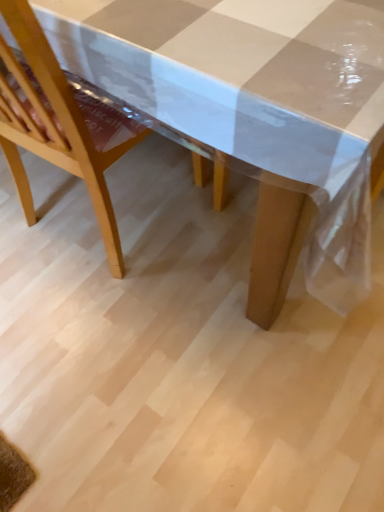
Question: Can you confirm if transparent plastic picnic table at center is taller than light wood chair at center?

Choices:
 (A) no
 (B) yes

Answer: (A)

Question: Considering the relative sizes of transparent plastic picnic table at center and light wood chair at center in the image provided, is transparent plastic picnic table at center smaller than light wood chair at center?

Choices:
 (A) no
 (B) yes

Answer: (A)

Question: From the image's perspective, is transparent plastic picnic table at center beneath light wood chair at center?

Choices:
 (A) no
 (B) yes

Answer: (A)

Question: Does transparent plastic picnic table at center contain light wood chair at center?

Choices:
 (A) no
 (B) yes

Answer: (B)

Question: Does transparent plastic picnic table at center have a larger size compared to light wood chair at center?

Choices:
 (A) yes
 (B) no

Answer: (A)

Question: From a real-world perspective, is transparent plastic picnic table at center over light wood chair at center?

Choices:
 (A) no
 (B) yes

Answer: (A)

Question: Is light wood chair at center surrounding transparent plastic picnic table at center?

Choices:
 (A) no
 (B) yes

Answer: (A)

Question: From the image's perspective, is light wood chair at center located above transparent plastic picnic table at center?

Choices:
 (A) yes
 (B) no

Answer: (B)

Question: Considering the relative sizes of light wood chair at center and transparent plastic picnic table at center in the image provided, is light wood chair at center taller than transparent plastic picnic table at center?

Choices:
 (A) no
 (B) yes

Answer: (B)

Question: From a real-world perspective, is light wood chair at center beneath transparent plastic picnic table at center?

Choices:
 (A) no
 (B) yes

Answer: (A)

Question: Can you confirm if light wood chair at center is bigger than transparent plastic picnic table at center?

Choices:
 (A) no
 (B) yes

Answer: (A)

Question: Is light wood chair at center looking in the opposite direction of transparent plastic picnic table at center?

Choices:
 (A) yes
 (B) no

Answer: (A)

Question: Is light wood chair at center in front of or behind transparent plastic picnic table at center in the image?

Choices:
 (A) behind
 (B) front

Answer: (A)